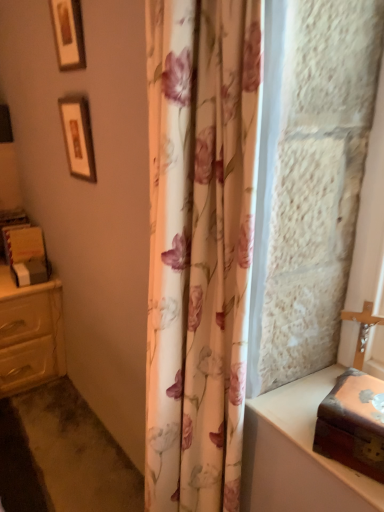
Identify the location of blank space to the left of wooden box at right. The height and width of the screenshot is (512, 384). click(x=295, y=428).